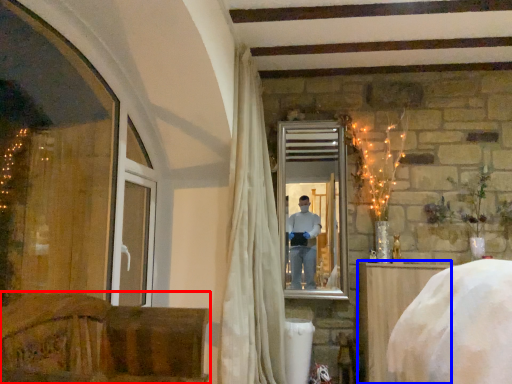
Question: Among these objects, which one is farthest to the camera, furniture (highlighted by a red box) or furniture (highlighted by a blue box)?

Choices:
 (A) furniture
 (B) furniture

Answer: (B)